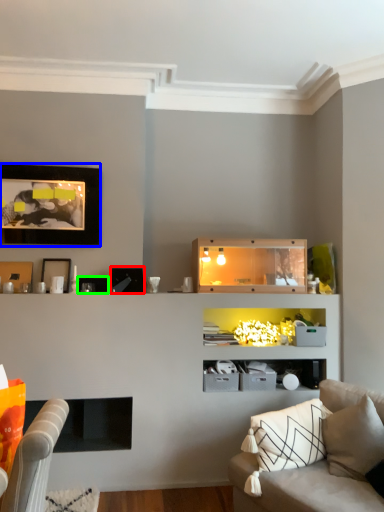
Question: Estimate the real-world distances between objects in this image. Which object is farther from picture frame (highlighted by a red box), picture frame (highlighted by a blue box) or picture frame (highlighted by a green box)?

Choices:
 (A) picture frame
 (B) picture frame

Answer: (A)